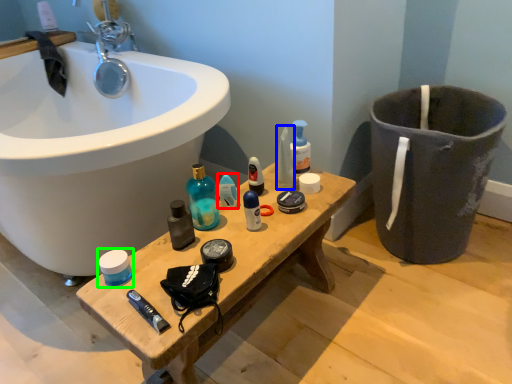
Question: Which object is positioned closest to toiletry (highlighted by a red box)? Select from toiletry (highlighted by a blue box) and mouthwash (highlighted by a green box).

Choices:
 (A) toiletry
 (B) mouthwash

Answer: (A)